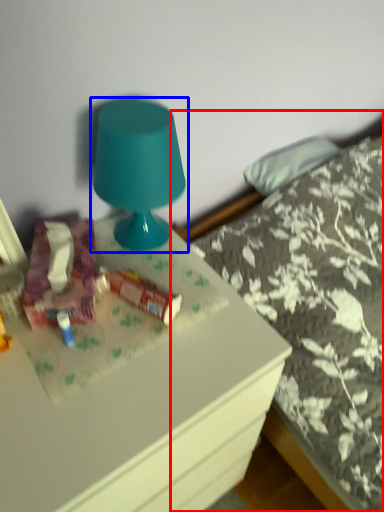
Question: Among these objects, which one is farthest to the camera, bed (highlighted by a red box) or lamp (highlighted by a blue box)?

Choices:
 (A) bed
 (B) lamp

Answer: (B)